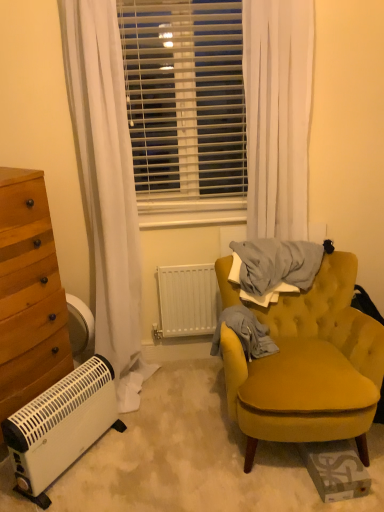
The width and height of the screenshot is (384, 512). What do you see at coordinates (61, 426) in the screenshot?
I see `white plastic heater at lower left` at bounding box center [61, 426].

You are a GUI agent. You are given a task and a screenshot of the screen. Output one action in this format:
    pyautogui.click(x=<x>, y=<y>)
    Task: Click on the white sheer curtain at upper center
    The width and height of the screenshot is (384, 512).
    Given the screenshot: What is the action you would take?
    pyautogui.click(x=277, y=114)

I want to click on white plastic blinds at center, so click(185, 102).

The image size is (384, 512). What are the coordinates of `wooden chest of drawers at left` in the screenshot? It's located at (29, 294).

Find the location of `white plastic heater at lower left`. white plastic heater at lower left is located at coordinates (61, 426).

Is velvet yellow armchair at right oriented towards white plastic blinds at center?

No, velvet yellow armchair at right does not turn towards white plastic blinds at center.

Does velvet yellow armchair at right have a greater width compared to white plastic blinds at center?

Correct, the width of velvet yellow armchair at right exceeds that of white plastic blinds at center.

Between velvet yellow armchair at right and white plastic blinds at center, which one appears on the right side from the viewer's perspective?

velvet yellow armchair at right.

Where is `chair located in front of the white plastic blinds at center`? chair located in front of the white plastic blinds at center is located at coordinates (309, 366).

Considering the positions of objects velvet yellow armchair at right and white plastic heater at lower left in the image provided, who is in front, velvet yellow armchair at right or white plastic heater at lower left?

velvet yellow armchair at right is more forward.

Which is more to the left, velvet yellow armchair at right or white plastic heater at lower left?

white plastic heater at lower left is more to the left.

Can you see velvet yellow armchair at right touching white plastic heater at lower left?

No, velvet yellow armchair at right is not with white plastic heater at lower left.

Identify the location of radiator located above the white plastic heater at lower left (from the image's perspective). (187, 301).

Is white plastic heater at lower left not inside white matte radiator at center?

Yes.

Considering the positions of objects white plastic heater at lower left and white matte radiator at center in the image provided, who is more to the left, white plastic heater at lower left or white matte radiator at center?

white plastic heater at lower left.

Is white plastic heater at lower left not near white matte radiator at center?

No, white plastic heater at lower left is in close proximity to white matte radiator at center.

Considering the positions of objects white sheer curtain at upper center and white plastic heater at lower left in the image provided, who is behind, white sheer curtain at upper center or white plastic heater at lower left?

Positioned behind is white sheer curtain at upper center.

Is white plastic heater at lower left a part of white sheer curtain at upper center?

Definitely not — white plastic heater at lower left is not inside white sheer curtain at upper center.

Based on the photo, from a real-world perspective, who is located lower, white sheer curtain at upper center or white plastic heater at lower left?

From a 3D spatial view, white plastic heater at lower left is below.

Is white plastic heater at lower left at the back of white sheer curtain at upper center?

No, white plastic heater at lower left is not at the back of white sheer curtain at upper center.

From a real-world perspective, is wooden chest of drawers at left physically located above or below light gray cotton blanket at center right?

wooden chest of drawers at left is above light gray cotton blanket at center right.

From the image's perspective, is wooden chest of drawers at left under light gray cotton blanket at center right?

No.

Looking at this image, which of these two, wooden chest of drawers at left or light gray cotton blanket at center right, stands taller?

wooden chest of drawers at left.

Looking at this image, is wooden chest of drawers at left looking in the opposite direction of light gray cotton blanket at center right?

wooden chest of drawers at left does not have its back to light gray cotton blanket at center right.

Does light gray cotton blanket at center right turn towards velvet yellow armchair at right?

Yes, light gray cotton blanket at center right faces towards velvet yellow armchair at right.

Which object is positioned more to the right, light gray cotton blanket at center right or velvet yellow armchair at right?

From the viewer's perspective, velvet yellow armchair at right appears more on the right side.

Are light gray cotton blanket at center right and velvet yellow armchair at right beside each other?

light gray cotton blanket at center right and velvet yellow armchair at right are clearly separated.

From the image's perspective, is light gray cotton blanket at center right below velvet yellow armchair at right?

Actually, light gray cotton blanket at center right appears above velvet yellow armchair at right in the image.

In the image, is white plastic blinds at center positioned in front of or behind white matte radiator at center?

white plastic blinds at center is in front of white matte radiator at center.

From a real-world perspective, which object stands above the other?

In real-world perspective, white plastic blinds at center is above.

From the picture: Are white plastic blinds at center and white matte radiator at center far apart?

No, white plastic blinds at center is not far away from white matte radiator at center.

Can you tell me how much white plastic blinds at center and white matte radiator at center differ in facing direction?

white plastic blinds at center and white matte radiator at center are facing 0.33 degrees away from each other.

The height and width of the screenshot is (512, 384). Identify the location of window blind positioned vertically above the velvet yellow armchair at right (from a real-world perspective). (185, 102).

Identify the location of air conditioning below the velvet yellow armchair at right (from a real-world perspective). This screenshot has width=384, height=512. [x=61, y=426].

Looking at the image, which one is located further to velvet yellow armchair at right, white plastic heater at lower left or white plastic blinds at center?

white plastic blinds at center is further to velvet yellow armchair at right.

Estimate the real-world distances between objects in this image. Which object is closer to light gray cotton blanket at center right, white plastic blinds at center or white matte radiator at center?

Based on the image, white matte radiator at center appears to be nearer to light gray cotton blanket at center right.

When comparing their distances from light gray cotton blanket at center right, does velvet yellow armchair at right or white plastic blinds at center seem closer?

The object closer to light gray cotton blanket at center right is velvet yellow armchair at right.

When comparing their distances from wooden chest of drawers at left, does velvet yellow armchair at right or light gray cotton blanket at center right seem further?

velvet yellow armchair at right.

When comparing their distances from white matte radiator at center, does velvet yellow armchair at right or light gray cotton blanket at center right seem closer?

light gray cotton blanket at center right lies closer to white matte radiator at center than the other object.

Based on their spatial positions, is white matte radiator at center or white sheer curtain at upper center closer to wooden chest of drawers at left?

white matte radiator at center lies closer to wooden chest of drawers at left than the other object.

Considering their positions, is white plastic heater at lower left positioned further to wooden chest of drawers at left than velvet yellow armchair at right?

Based on the image, velvet yellow armchair at right appears to be further to wooden chest of drawers at left.

Based on their spatial positions, is light gray cotton blanket at center right or white sheer curtain at upper center further from white plastic blinds at center?

The object further to white plastic blinds at center is light gray cotton blanket at center right.

Image resolution: width=384 pixels, height=512 pixels. I want to click on curtain that lies between white plastic blinds at center and white plastic heater at lower left from top to bottom, so click(x=277, y=114).

The height and width of the screenshot is (512, 384). In order to click on air conditioning between wooden chest of drawers at left and white sheer curtain at upper center in this screenshot , I will do `click(61, 426)`.

Identify the location of radiator between wooden chest of drawers at left and velvet yellow armchair at right. (187, 301).

At what (x,y) coordinates should I click in order to perform the action: click on chair between white plastic blinds at center and white plastic heater at lower left in the up-down direction. Please return your answer as a coordinate pair (x, y). The width and height of the screenshot is (384, 512). Looking at the image, I should click on (309, 366).